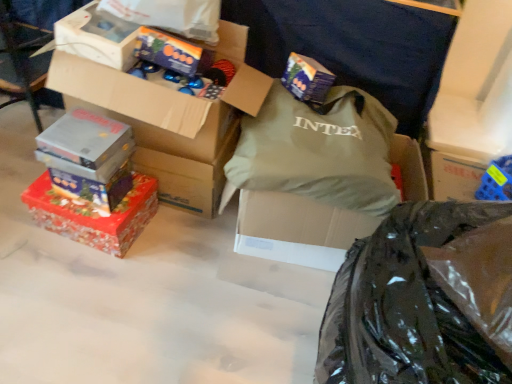
Question: From the image's perspective, is green fabric bag at center located above shiny metallic box at upper center, which appears as the sixth box when viewed from the left?

Choices:
 (A) no
 (B) yes

Answer: (A)

Question: Are green fabric bag at center and shiny metallic box at upper center, which appears as the sixth box when viewed from the left, beside each other?

Choices:
 (A) no
 (B) yes

Answer: (A)

Question: Is green fabric bag at center to the right of shiny metallic box at upper center, which appears as the sixth box when viewed from the left, from the viewer's perspective?

Choices:
 (A) no
 (B) yes

Answer: (B)

Question: Would you consider green fabric bag at center to be distant from shiny metallic box at upper center, positioned as the 2th box in right-to-left order?

Choices:
 (A) no
 (B) yes

Answer: (A)

Question: Considering the relative sizes of green fabric bag at center and shiny metallic box at upper center, positioned as the 2th box in right-to-left order, in the image provided, is green fabric bag at center thinner than shiny metallic box at upper center, positioned as the 2th box in right-to-left order,?

Choices:
 (A) yes
 (B) no

Answer: (B)

Question: From a real-world perspective, is cardboard box at upper left, marked as the fifth box in a left-to-right arrangement, physically located above or below shiny red wrapping paper at lower left, placed as the seventh box when sorted from right to left?

Choices:
 (A) below
 (B) above

Answer: (B)

Question: From the image's perspective, is cardboard box at upper left, marked as the fifth box in a left-to-right arrangement, located above or below shiny red wrapping paper at lower left, placed as the seventh box when sorted from right to left?

Choices:
 (A) above
 (B) below

Answer: (A)

Question: In terms of size, does cardboard box at upper left, marked as the fifth box in a left-to-right arrangement, appear bigger or smaller than shiny red wrapping paper at lower left, placed as the seventh box when sorted from right to left?

Choices:
 (A) small
 (B) big

Answer: (B)

Question: Is cardboard box at upper left, marked as the fifth box in a left-to-right arrangement, wider or thinner than shiny red wrapping paper at lower left, placed as the seventh box when sorted from right to left?

Choices:
 (A) thin
 (B) wide

Answer: (B)

Question: Considering the positions of shiny metallic box at upper center, which appears as the sixth box when viewed from the left, and black glossy plastic bag at lower right in the image, is shiny metallic box at upper center, which appears as the sixth box when viewed from the left, wider or thinner than black glossy plastic bag at lower right?

Choices:
 (A) thin
 (B) wide

Answer: (A)

Question: In the image, is shiny metallic box at upper center, positioned as the 2th box in right-to-left order, on the left side or the right side of black glossy plastic bag at lower right?

Choices:
 (A) left
 (B) right

Answer: (A)

Question: In terms of height, does shiny metallic box at upper center, positioned as the 2th box in right-to-left order, look taller or shorter compared to black glossy plastic bag at lower right?

Choices:
 (A) tall
 (B) short

Answer: (B)

Question: Looking at the image, does shiny metallic box at upper center, which appears as the sixth box when viewed from the left, seem bigger or smaller compared to black glossy plastic bag at lower right?

Choices:
 (A) big
 (B) small

Answer: (B)

Question: Relative to shiny red wrapping paper at lower left, the 1th box when ordered from left to right, is metallic silver box at left, the second box positioned from the left, in front or behind?

Choices:
 (A) behind
 (B) front

Answer: (B)

Question: Is metallic silver box at left, which appears as the 6th box when viewed from the right, taller or shorter than shiny red wrapping paper at lower left, placed as the seventh box when sorted from right to left?

Choices:
 (A) tall
 (B) short

Answer: (B)